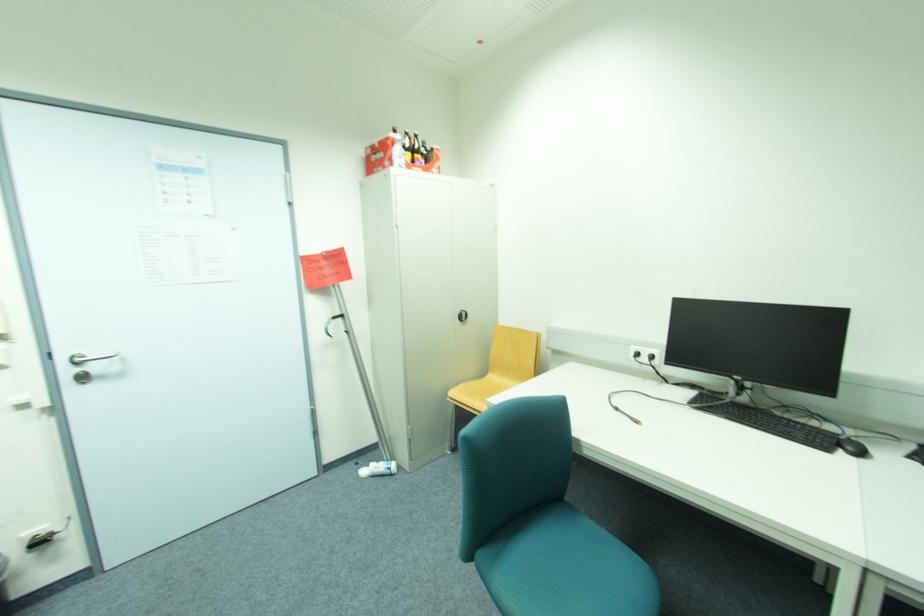
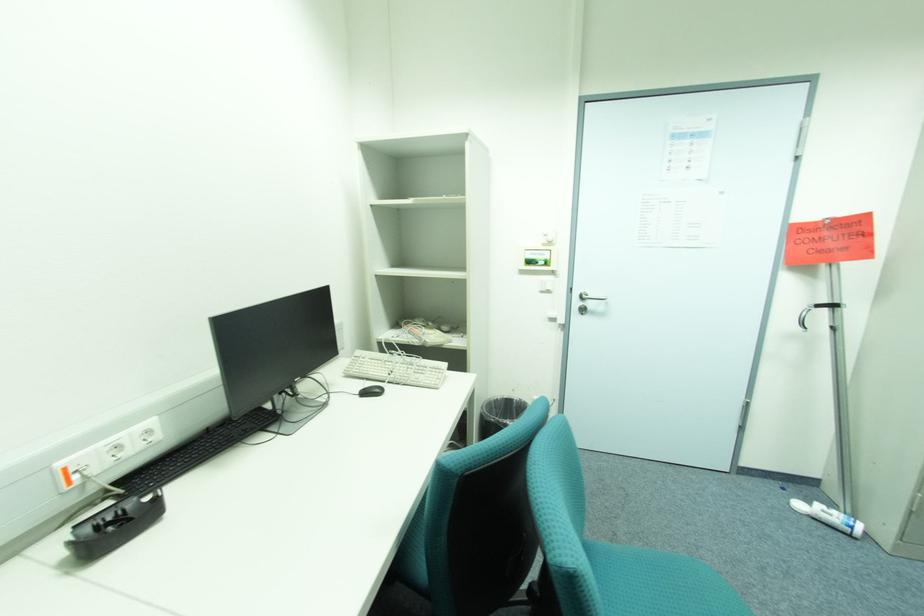
Question: The images are taken continuously from a first-person perspective. In which direction is your viewpoint rotating?

Choices:
 (A) Left
 (B) Right
 (C) Up
 (D) Down

Answer: (A)